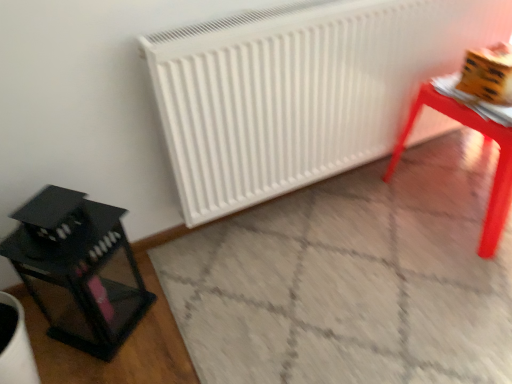
I want to click on vacant space behind black glass lantern at left, so click(x=138, y=268).